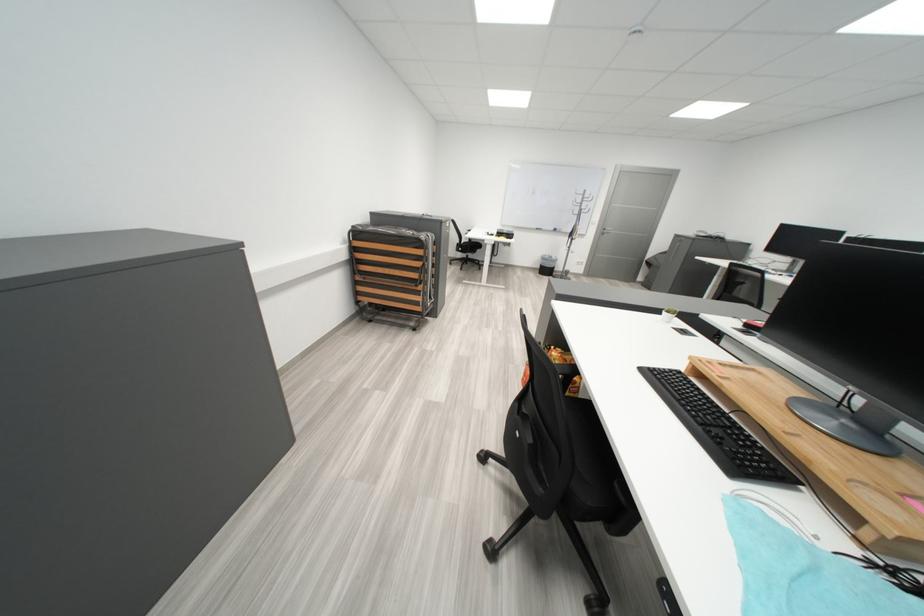
The height and width of the screenshot is (616, 924). What are the coordinates of `silver coat hook` in the screenshot? It's located at (578, 195).